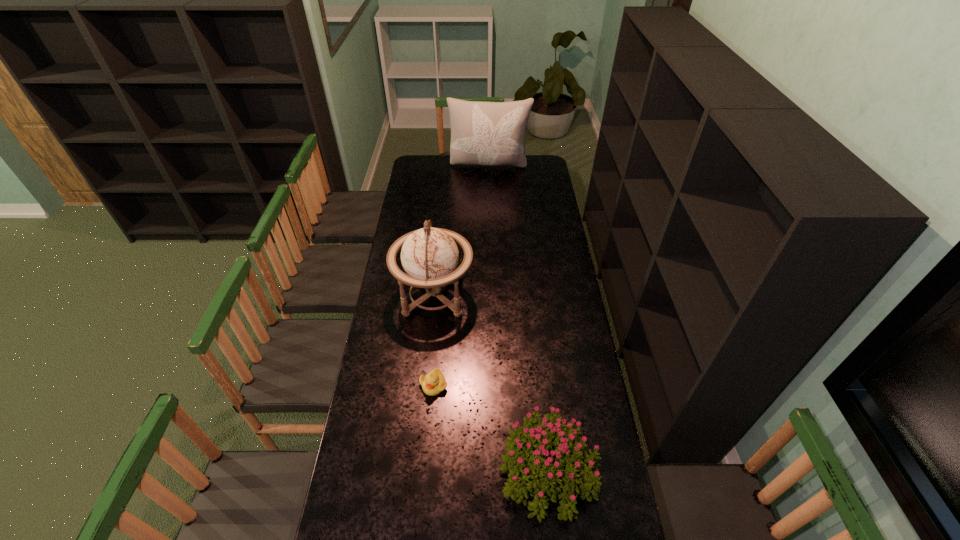
Locate an element on the screen. free location that satisfies the following two spatial constraints: 1. at the face of the second shortest object; 2. on the right side of the duckling is located at coordinates (426, 471).

Identify the location of free space that satisfies the following two spatial constraints: 1. at the front of the globe showing Africa; 2. on the right side of the third tallest object. (417, 471).

In order to click on blank space that satisfies the following two spatial constraints: 1. on the front side of the farthest object; 2. at the front of the second farthest object showing Africa in this screenshot , I will do `click(492, 296)`.

Image resolution: width=960 pixels, height=540 pixels. I want to click on free space that satisfies the following two spatial constraints: 1. at the front of the third tallest object showing Africa; 2. on the right side of the third nearest object, so click(417, 471).

At what (x,y) coordinates should I click in order to perform the action: click on free space in the image that satisfies the following two spatial constraints: 1. at the face of the second nearest object; 2. on the right side of the bouquet. Please return your answer as a coordinate pair (x, y). Looking at the image, I should click on (426, 471).

The width and height of the screenshot is (960, 540). Find the location of `vacant region that satisfies the following two spatial constraints: 1. at the front of the third tallest object showing Africa; 2. on the right side of the globe`. vacant region that satisfies the following two spatial constraints: 1. at the front of the third tallest object showing Africa; 2. on the right side of the globe is located at coordinates (417, 471).

The width and height of the screenshot is (960, 540). Identify the location of vacant space that satisfies the following two spatial constraints: 1. on the front side of the cushion; 2. at the front of the second farthest object showing Africa. (492, 296).

Where is `free space that satisfies the following two spatial constraints: 1. on the front side of the cushion; 2. at the front of the second farthest object showing Africa`? free space that satisfies the following two spatial constraints: 1. on the front side of the cushion; 2. at the front of the second farthest object showing Africa is located at coordinates pyautogui.click(x=492, y=296).